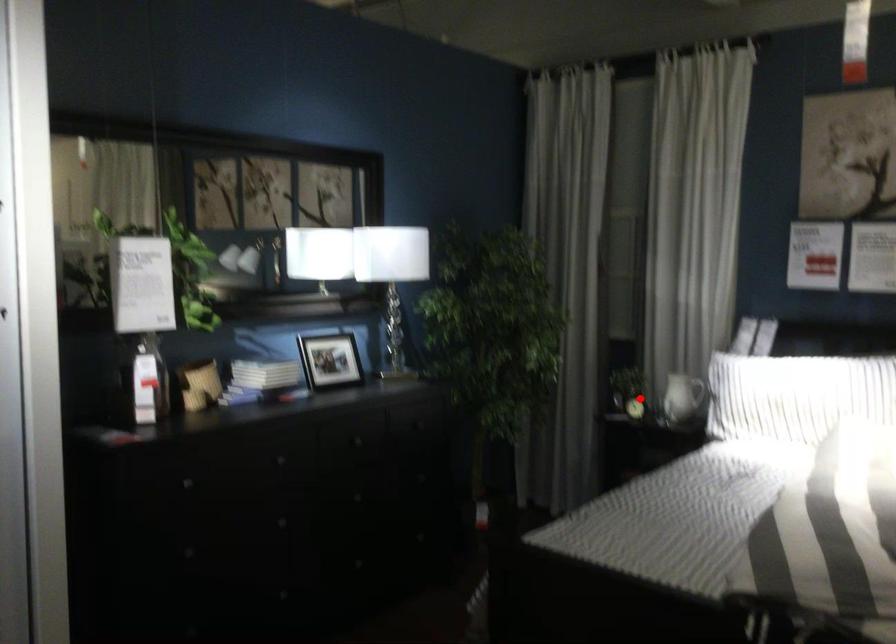
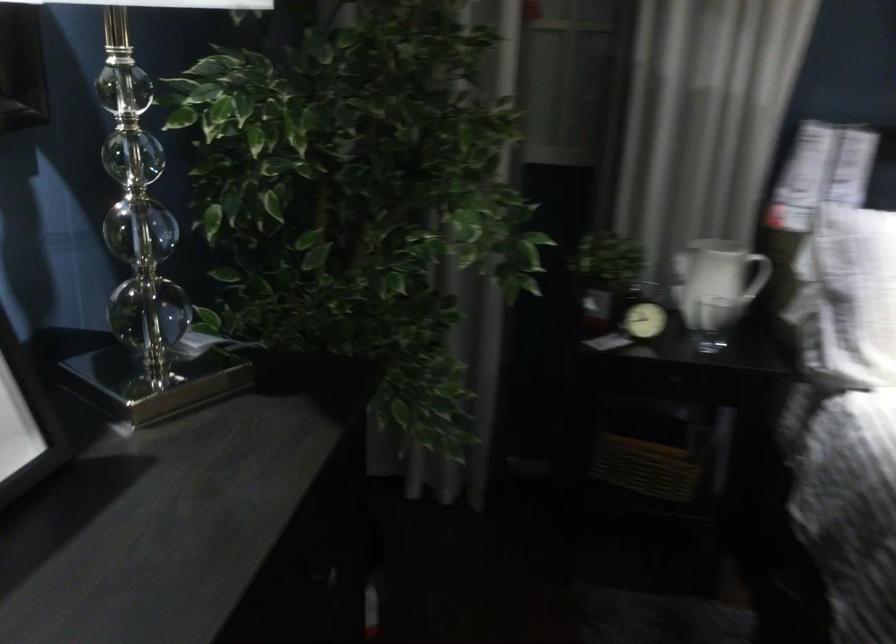
In the second image, find the point that corresponds to the highlighted location in the first image.

(643, 321)